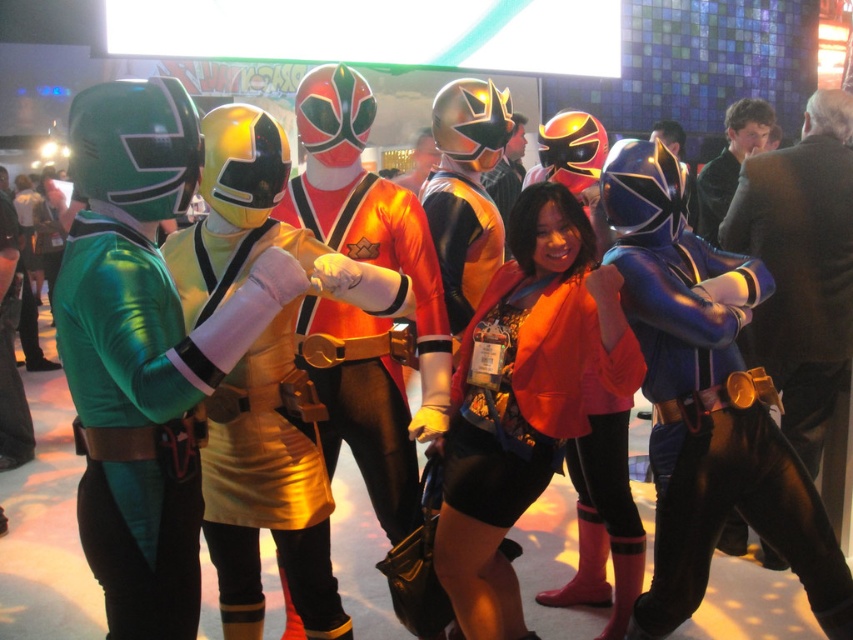
Question: Does matte orange jacket at center appear on the left side of shiny orange costume at center?

Choices:
 (A) yes
 (B) no

Answer: (B)

Question: Considering the relative positions of matte orange jacket at center and shiny orange costume at center in the image provided, where is matte orange jacket at center located with respect to shiny orange costume at center?

Choices:
 (A) above
 (B) below

Answer: (B)

Question: Which point is closer to the camera?

Choices:
 (A) shiny orange costume at center
 (B) matte orange jacket at center

Answer: (B)

Question: Does matte orange jacket at center have a greater width compared to shiny orange costume at center?

Choices:
 (A) yes
 (B) no

Answer: (B)